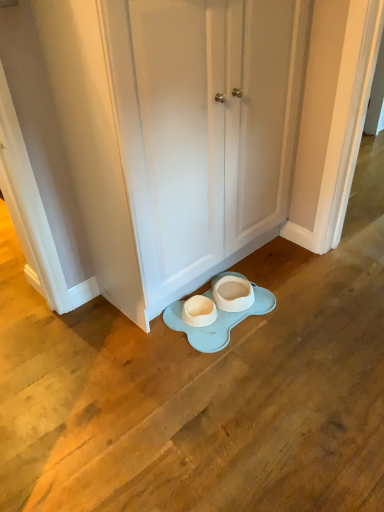
The width and height of the screenshot is (384, 512). I want to click on free space that is to the left of white matte porcelain at center, so click(145, 343).